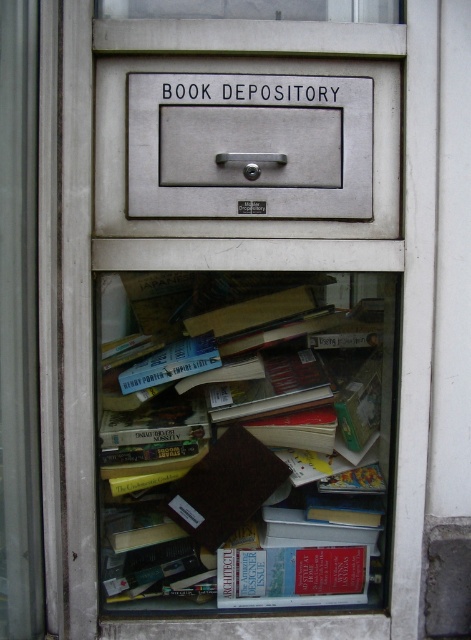
You are an office assistant who needs to place a new book on the shelf in the book depository. The book you have is exactly 30 cm in width. Can you determine if there is enough space on the shelf where the brown paper bag at center is located to fit the book?

The brown paper bag at center is located at point (257, 445), but the exact dimensions of the shelf space there are not provided. Therefore, it is uncertain if the 30 cm wide book will fit. Check the shelf dimensions before placing the book.

You are a delivery person trying to place a new book into the book depository. The book is too large to fit through the front glass panel. You need to open the drawer and place it inside. However, you notice two points marked on the cabinet. The first point is at coordinate point(340, 470) and the second is at point(307, 152). Which point is closer to the front of the cabinet where you can easily reach to open the drawer?

Point(307, 152) is closer to the front of the cabinet because it is closer to the camera than point(340, 470), making it easier to reach to open the drawer.